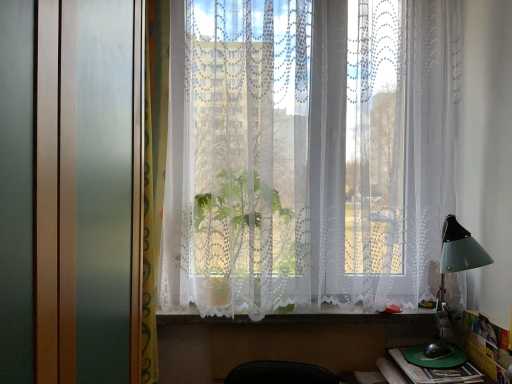
Question: In terms of width, does green plastic plate at lower right look wider or thinner when compared to green patterned curtain at left?

Choices:
 (A) wide
 (B) thin

Answer: (A)

Question: From a real-world perspective, is green plastic plate at lower right positioned above or below green patterned curtain at left?

Choices:
 (A) above
 (B) below

Answer: (B)

Question: Which object is positioned closest to the white lace curtains at center?

Choices:
 (A) green plastic plate at lower right
 (B) green plastic book at lower right
 (C) white lace curtain at lower center
 (D) green patterned curtain at left

Answer: (D)

Question: Which is farther from the green patterned curtain at left?

Choices:
 (A) green plastic book at lower right
 (B) white lace curtains at center
 (C) white lace curtain at lower center
 (D) green plastic plate at lower right

Answer: (D)